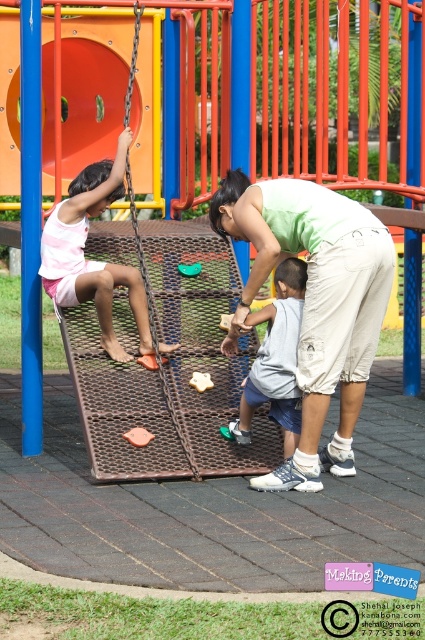
Between green cotton shirt at center and metallic yellow star at center, which one is positioned lower?

green cotton shirt at center is below.

Which is behind, point (342, 365) or point (184, 266)?

Point (184, 266)

Which is behind, point (272, 253) or point (189, 266)?

The point (189, 266) is more distant.

Locate an element on the screen. The image size is (425, 640). green cotton shirt at center is located at coordinates (314, 301).

Is point (275, 288) in front of point (136, 435)?

That is False.

Which of these two, gray fabric shorts at center or rubberized plastic toy at center, stands taller?

gray fabric shorts at center is taller.

The height and width of the screenshot is (640, 425). In order to click on gray fabric shorts at center in this screenshot , I will do `click(275, 360)`.

Locate an element on the screen. The image size is (425, 640). gray fabric shorts at center is located at coordinates click(x=275, y=360).

Is rubberized plastic toy at center to the left of yellow matte star at center from the viewer's perspective?

Indeed, rubberized plastic toy at center is positioned on the left side of yellow matte star at center.

Is point (124, 433) more distant than point (200, 387)?

No, (124, 433) is closer to viewer.

At what (x,y) coordinates should I click in order to perform the action: click on rubberized plastic toy at center. Please return your answer as a coordinate pair (x, y). This screenshot has height=640, width=425. Looking at the image, I should click on (138, 436).